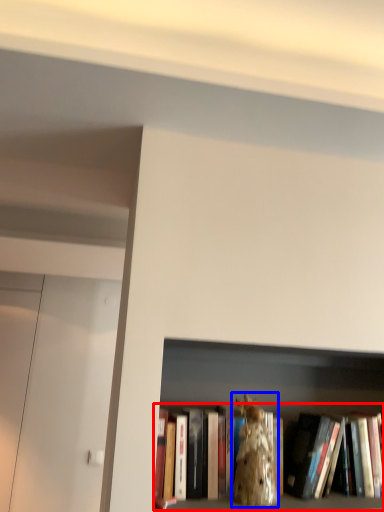
Question: Which of the following is the farthest to the observer, book (highlighted by a red box) or animal (highlighted by a blue box)?

Choices:
 (A) book
 (B) animal

Answer: (A)